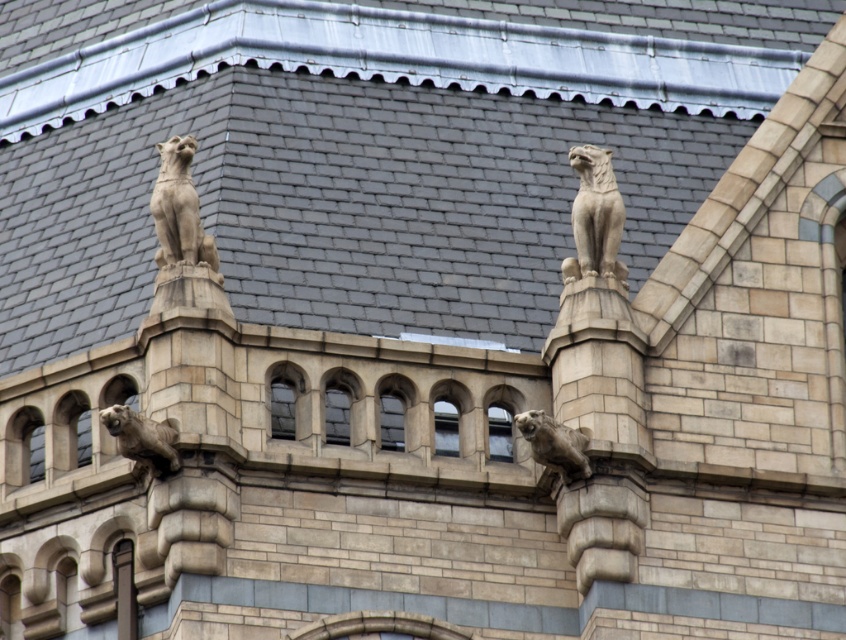
Question: Which object appears closest to the camera in this image?

Choices:
 (A) stone tiger at upper right
 (B) matte stone gargoyle at center
 (C) matte stone cat at upper left
 (D) brown stone gargoyle at center

Answer: (B)

Question: Which object appears farthest from the camera in this image?

Choices:
 (A) stone tiger at upper right
 (B) gray stone roof at upper center

Answer: (B)

Question: Is stone tiger at upper right to the left of matte stone cat at upper left from the viewer's perspective?

Choices:
 (A) yes
 (B) no

Answer: (B)

Question: Does gray stone roof at upper center come behind brown stone gargoyle at center?

Choices:
 (A) no
 (B) yes

Answer: (B)

Question: Is matte stone gargoyle at center thinner than brown stone gargoyle at center?

Choices:
 (A) yes
 (B) no

Answer: (A)

Question: Which point is closer to the camera?

Choices:
 (A) (4, 36)
 (B) (202, 232)
 (C) (575, 433)
 (D) (163, 445)

Answer: (D)